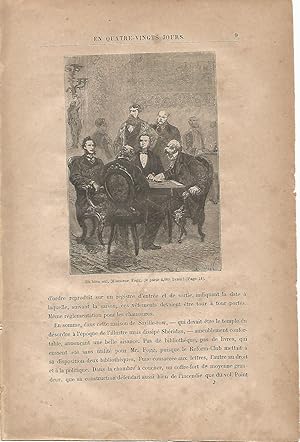
Image resolution: width=300 pixels, height=442 pixels. Find the location of `chairs`. chairs is located at coordinates (115, 186), (210, 164), (81, 222).